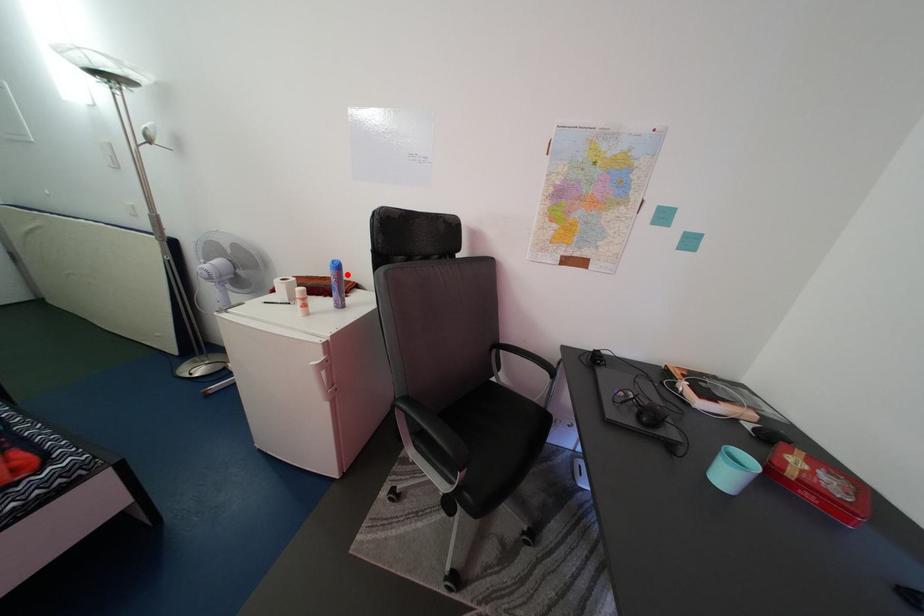
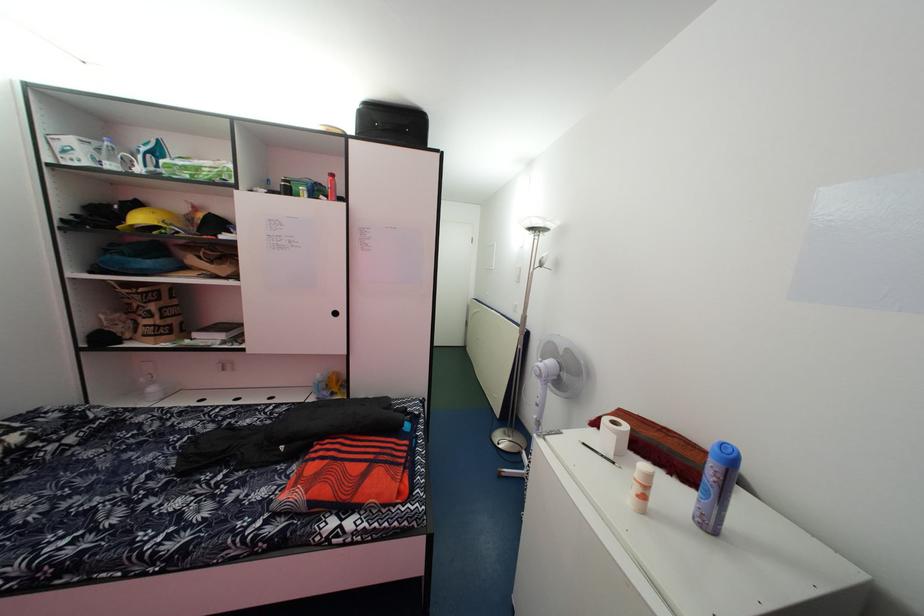
Where in the second image is the point corresponding to the highlighted location from the first image?

(738, 466)